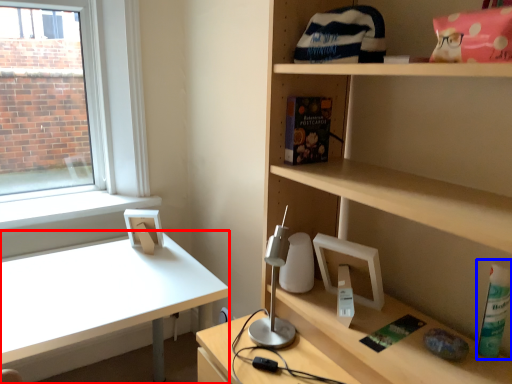
Question: Which object appears farthest to the camera in this image, desk (highlighted by a red box) or bottle (highlighted by a blue box)?

Choices:
 (A) desk
 (B) bottle

Answer: (A)